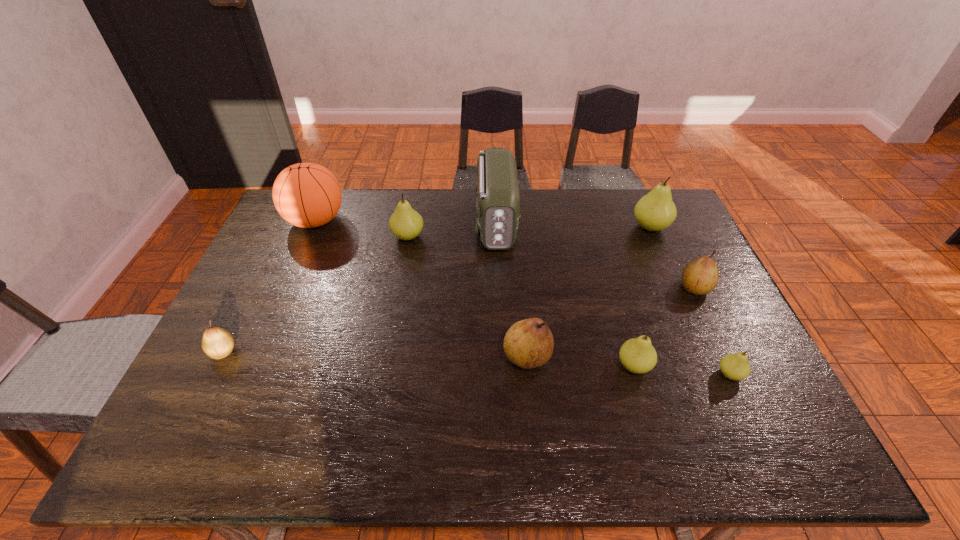
This screenshot has height=540, width=960. Identify the location of vacant space positioned on the right of the sixth object from left to right. (735, 366).

Find the location of `vacant space located 0.130m on the front of the smallest brown pear`. vacant space located 0.130m on the front of the smallest brown pear is located at coordinates (194, 410).

At what (x,y) coordinates should I click in order to perform the action: click on free space located on the back of the smallest green pear. Please return your answer as a coordinate pair (x, y). Looking at the image, I should click on (694, 296).

This screenshot has height=540, width=960. In order to click on radio_receiver that is at the far edge in this screenshot , I will do `click(497, 191)`.

You are a GUI agent. You are given a task and a screenshot of the screen. Output one action in this format:
    pyautogui.click(x=<x>, y=<y>)
    Task: Click on the basketball that is at the far edge
    
    Given the screenshot: What is the action you would take?
    pyautogui.click(x=307, y=195)

Locate an element on the screen. basketball at the left edge is located at coordinates (307, 195).

You are a GUI agent. You are given a task and a screenshot of the screen. Output one action in this format:
    pyautogui.click(x=<x>, y=<y>)
    Task: Click on the pear located in the left edge section of the desktop
    This screenshot has width=960, height=540.
    Given the screenshot: What is the action you would take?
    pyautogui.click(x=217, y=343)

Find the location of a particular element. Image resolution: width=960 pixels, height=540 pixels. object present at the far left corner is located at coordinates (307, 195).

The height and width of the screenshot is (540, 960). What are the coordinates of `object that is positioned at the far right corner` in the screenshot? It's located at (655, 211).

Locate an element on the screen. This screenshot has width=960, height=540. vacant area at the far edge is located at coordinates (367, 194).